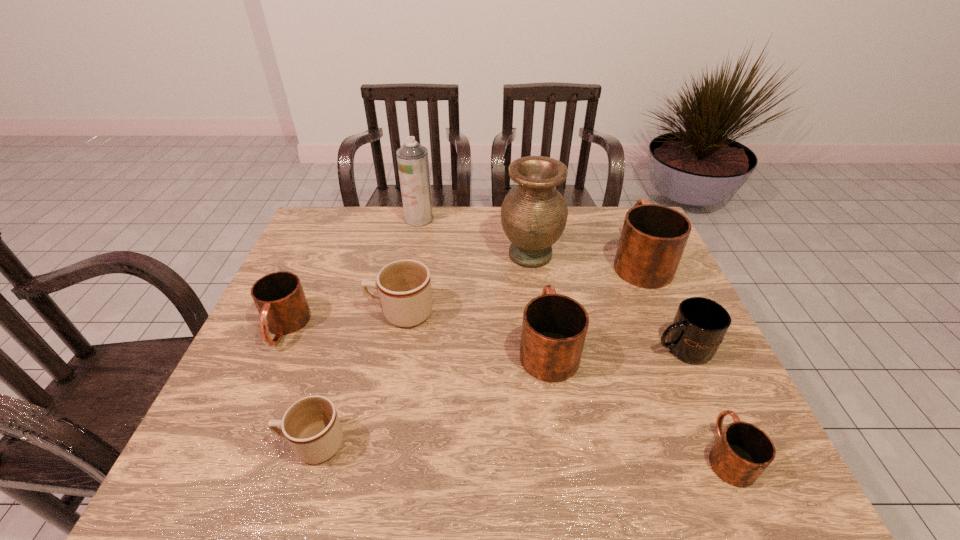
Identify the location of vacant space that satisfies the following two spatial constraints: 1. on the side of the farthest object with the handle; 2. on the right side of the farther brown mug. (419, 219).